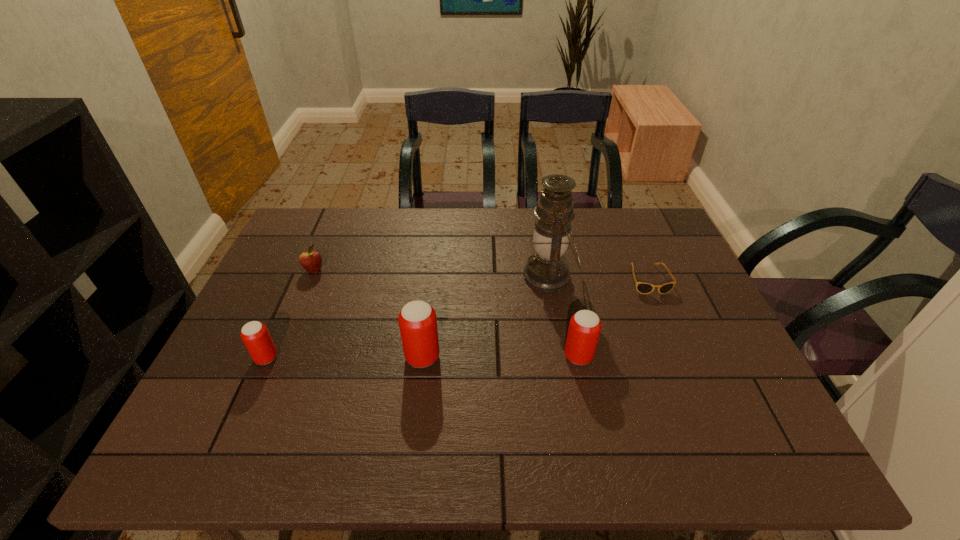
The height and width of the screenshot is (540, 960). In the image, there is a desktop. Find the location of `vacant space at the near edge`. vacant space at the near edge is located at coordinates (504, 416).

Image resolution: width=960 pixels, height=540 pixels. Identify the location of vacant space at the right edge of the desktop. (682, 326).

At what (x,y) coordinates should I click in order to perform the action: click on vacant space at the far left corner of the desktop. Please return your answer as a coordinate pair (x, y). Looking at the image, I should click on (319, 224).

The width and height of the screenshot is (960, 540). In order to click on vacant space at the near right corner in this screenshot , I will do `click(754, 402)`.

The image size is (960, 540). Identify the location of free space between the apple and the rightmost object. (481, 275).

I want to click on vacant area that lies between the third tallest object and the third object from left to right, so click(500, 356).

Find the location of a particular element. free space between the second shortest object and the tallest beer can is located at coordinates (369, 314).

Where is `empty space between the third object from left to right and the oil lamp`? Image resolution: width=960 pixels, height=540 pixels. empty space between the third object from left to right and the oil lamp is located at coordinates (486, 316).

Identify the location of vacant space that's between the rightmost object and the fifth tallest object. (481, 275).

Locate an element on the screen. The width and height of the screenshot is (960, 540). free space between the tallest beer can and the shortest beer can is located at coordinates (345, 357).